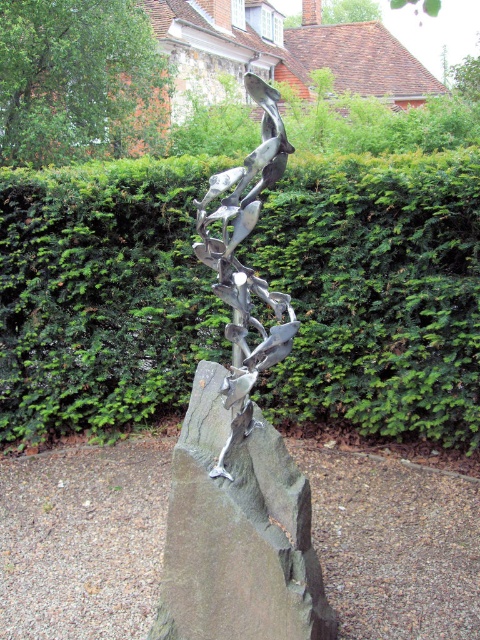
You are an artist planning to photograph the polished gray rock at center and the polished bronze sculpture at center. Which object should you focus on first if you want to capture the taller one in your composition?

The polished bronze sculpture at center is taller than the polished gray rock at center, so you should focus on the polished bronze sculpture at center first to capture the taller one in your composition.

You are a gardener who needs to water both the green leafy hedge at center and the polished gray rock at center. The water hose you have can reach 2 meters. Can you water both objects without moving the hose? Explain your reasoning.

The green leafy hedge at center is 2.34 meters from the polished gray rock at center. Since the distance between them is greater than the 2 meter hose reach, you cannot water both without moving the hose.

You are an artist planning to paint the scene. You want to ensure the green leafy hedge at center and the polished gray rock at center are accurately depicted. Based on their positions, which object should you paint first to maintain proper layering?

The green leafy hedge at center should be painted first because it is positioned over the polished gray rock at center, meaning it appears in front and needs to be layered on top.